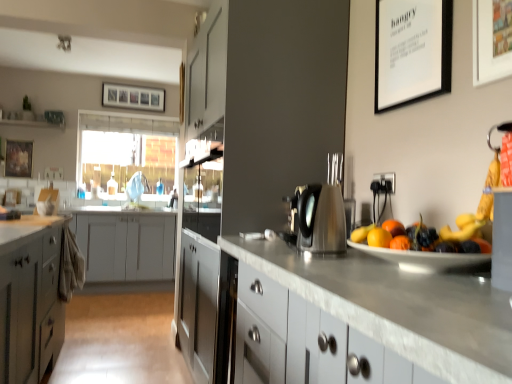
The width and height of the screenshot is (512, 384). What do you see at coordinates (411, 51) in the screenshot?
I see `white matte picture frame at upper right, which is the 2th picture frame in right-to-left order` at bounding box center [411, 51].

What do you see at coordinates (492, 40) in the screenshot? I see `white matte picture frame at upper right, the fourth picture frame viewed from the left` at bounding box center [492, 40].

I want to click on satin nickel faucet at center, so click(137, 187).

The image size is (512, 384). Find the location of `white matte picture frame at upper right, which is the 2th picture frame in right-to-left order`. white matte picture frame at upper right, which is the 2th picture frame in right-to-left order is located at coordinates (411, 51).

This screenshot has height=384, width=512. What are the coordinates of `the 1st picture frame positioned above the wooden framed artwork at upper left, the second picture frame viewed from the back (from the image's perspective)` in the screenshot? It's located at (492, 40).

From their relative heights in the image, would you say wooden framed artwork at upper left, the first picture frame from the left, is taller or shorter than white matte picture frame at upper right, the fourth picture frame viewed from the left?

Considering their sizes, wooden framed artwork at upper left, the first picture frame from the left, has more height than white matte picture frame at upper right, the fourth picture frame viewed from the left.

Looking at their sizes, would you say wooden framed artwork at upper left, the first picture frame from the left, is wider or thinner than white matte picture frame at upper right, which is the first picture frame in front-to-back order?

wooden framed artwork at upper left, the first picture frame from the left, is thinner than white matte picture frame at upper right, which is the first picture frame in front-to-back order.

Is wooden framed artwork at upper left, arranged as the 4th picture frame when viewed from the right, not inside white matte picture frame at upper right, the 4th picture frame when ordered from back to front?

Yes, wooden framed artwork at upper left, arranged as the 4th picture frame when viewed from the right, is outside of white matte picture frame at upper right, the 4th picture frame when ordered from back to front.

Is wooden picture frame at upper center, arranged as the 1th picture frame when viewed from the back, aimed at white matte picture frame at upper right, the first picture frame when ordered from right to left?

Yes.

Where is `the 2nd picture frame below the wooden picture frame at upper center, the 4th picture frame when ordered from front to back (from the image's perspective)`? This screenshot has height=384, width=512. the 2nd picture frame below the wooden picture frame at upper center, the 4th picture frame when ordered from front to back (from the image's perspective) is located at coordinates (492, 40).

From the image's perspective, which is below, wooden picture frame at upper center, arranged as the 1th picture frame when viewed from the back, or white matte picture frame at upper right, the first picture frame when ordered from right to left?

white matte picture frame at upper right, the first picture frame when ordered from right to left, appears lower in the image.

Is wooden picture frame at upper center, acting as the third picture frame starting from the right, closer to camera compared to white matte picture frame at upper right, which is the first picture frame in front-to-back order?

No, wooden picture frame at upper center, acting as the third picture frame starting from the right, is further to the viewer.

From a real-world perspective, which is physically above, white matte picture frame at upper right, the 4th picture frame when ordered from back to front, or metallic silver fruit dish at right?

white matte picture frame at upper right, the 4th picture frame when ordered from back to front.

Image resolution: width=512 pixels, height=384 pixels. I want to click on picture frame that is the 2nd one when counting rightward from the metallic silver fruit dish at right, so [x=492, y=40].

Based on the photo, from the image's perspective, does white matte picture frame at upper right, the first picture frame when ordered from right to left, appear higher than metallic silver fruit dish at right?

Yes, from the image's perspective, white matte picture frame at upper right, the first picture frame when ordered from right to left, is above metallic silver fruit dish at right.

What's the angular difference between white matte picture frame at upper right, the first picture frame when ordered from right to left, and metallic silver fruit dish at right's facing directions?

The facing directions of white matte picture frame at upper right, the first picture frame when ordered from right to left, and metallic silver fruit dish at right are 0.0027 degrees apart.

Which object is further away from the camera taking this photo, satin nickel faucet at center or metallic silver fruit dish at right?

satin nickel faucet at center is behind.

Is satin nickel faucet at center wider or thinner than metallic silver fruit dish at right?

satin nickel faucet at center is thinner than metallic silver fruit dish at right.

Which is closer to the camera, (145,188) or (454,266)?

Point (145,188) is farther from the camera than point (454,266).

Consider the image. Can we say satin nickel faucet at center lies outside metallic silver fruit dish at right?

Indeed, satin nickel faucet at center is completely outside metallic silver fruit dish at right.

Is point (138, 190) closer or farther from the camera than point (188, 314)?

Point (138, 190) is farther from the camera than point (188, 314).

Is satin nickel faucet at center smaller than satin gray cabinet at center?

Correct, satin nickel faucet at center occupies less space than satin gray cabinet at center.

Is satin gray cabinet at center at the back of satin nickel faucet at center?

That's not correct — satin nickel faucet at center is not looking away from satin gray cabinet at center.

Who is smaller, white matte picture frame at upper right, which is the 2th picture frame in right-to-left order, or translucent plastic window screen at upper left?

white matte picture frame at upper right, which is the 2th picture frame in right-to-left order.

How many degrees apart are the facing directions of white matte picture frame at upper right, acting as the second picture frame starting from the front, and translucent plastic window screen at upper left?

91 degrees.

Considering the positions of points (404, 85) and (125, 150), is point (404, 85) closer to camera compared to point (125, 150)?

That is True.

Is translucent plastic window screen at upper left oriented away from satin gray cabinet at center?

That's not correct — translucent plastic window screen at upper left is not looking away from satin gray cabinet at center.

Can you see translucent plastic window screen at upper left touching satin gray cabinet at center?

No.

Does point (153, 126) lie in front of point (312, 127)?

No, it is not.

From a real-world perspective, relative to satin gray cabinet at center, is translucent plastic window screen at upper left vertically above or below?

translucent plastic window screen at upper left is above satin gray cabinet at center.

Find the location of a particular element. the 3rd picture frame counting from the left side of the white matte picture frame at upper right, the fourth picture frame viewed from the left is located at coordinates (18, 158).

I want to click on the 3rd picture frame behind the white matte picture frame at upper right, which is the first picture frame in front-to-back order, counting from the anchor's position, so click(133, 97).

When comparing their distances from white matte picture frame at upper right, acting as the second picture frame starting from the front, does metallic silver fruit dish at right or wooden picture frame at upper center, the 4th picture frame when ordered from front to back, seem closer?

metallic silver fruit dish at right is positioned closer to the anchor white matte picture frame at upper right, acting as the second picture frame starting from the front.

Based on their spatial positions, is satin gray cabinet at center or white matte picture frame at upper right, the fourth picture frame viewed from the left, further from translucent plastic window screen at upper left?

white matte picture frame at upper right, the fourth picture frame viewed from the left, is positioned further to the anchor translucent plastic window screen at upper left.

Based on their spatial positions, is white matte picture frame at upper right, the first picture frame when ordered from right to left, or white matte picture frame at upper right, arranged as the third picture frame when viewed from the left, further from wooden framed artwork at upper left, arranged as the 4th picture frame when viewed from the right?

white matte picture frame at upper right, the first picture frame when ordered from right to left, is further to wooden framed artwork at upper left, arranged as the 4th picture frame when viewed from the right.

Considering their positions, is wooden picture frame at upper center, arranged as the 1th picture frame when viewed from the back, positioned closer to metallic silver fruit dish at right than satin nickel faucet at center?

The object closer to metallic silver fruit dish at right is satin nickel faucet at center.

Looking at the image, which one is located closer to white matte picture frame at upper right, acting as the second picture frame starting from the front, satin gray cabinet at center or white matte picture frame at upper right, the 4th picture frame when ordered from back to front?

Among the two, white matte picture frame at upper right, the 4th picture frame when ordered from back to front, is located nearer to white matte picture frame at upper right, acting as the second picture frame starting from the front.

Looking at this image, looking at the image, which one is located further to wooden picture frame at upper center, arranged as the 1th picture frame when viewed from the back, satin gray cabinet at center or white matte picture frame at upper right, the first picture frame when ordered from right to left?

Among the two, white matte picture frame at upper right, the first picture frame when ordered from right to left, is located further to wooden picture frame at upper center, arranged as the 1th picture frame when viewed from the back.

When comparing their distances from translucent plastic window screen at upper left, does wooden picture frame at upper center, acting as the third picture frame starting from the right, or satin gray cabinet at center seem further?

satin gray cabinet at center.

Estimate the real-world distances between objects in this image. Which object is closer to satin silver kettle at center, translucent plastic window screen at upper left or white matte picture frame at upper right, the first picture frame when ordered from right to left?

white matte picture frame at upper right, the first picture frame when ordered from right to left, is closer to satin silver kettle at center.

The image size is (512, 384). In order to click on picture frame between satin silver kettle at center and wooden framed artwork at upper left, arranged as the 4th picture frame when viewed from the right, from front to back in this screenshot , I will do `click(411, 51)`.

Identify the location of faucet between satin gray cabinet at center and wooden picture frame at upper center, the second picture frame from the left, from front to back. (137, 187).

Where is `kitchen appliance between metallic silver fruit dish at right and wooden picture frame at upper center, arranged as the 1th picture frame when viewed from the back, along the z-axis`? The image size is (512, 384). kitchen appliance between metallic silver fruit dish at right and wooden picture frame at upper center, arranged as the 1th picture frame when viewed from the back, along the z-axis is located at coordinates (321, 219).

Where is `dresser between satin silver kettle at center and wooden picture frame at upper center, acting as the third picture frame starting from the right, along the z-axis`? dresser between satin silver kettle at center and wooden picture frame at upper center, acting as the third picture frame starting from the right, along the z-axis is located at coordinates (256, 139).